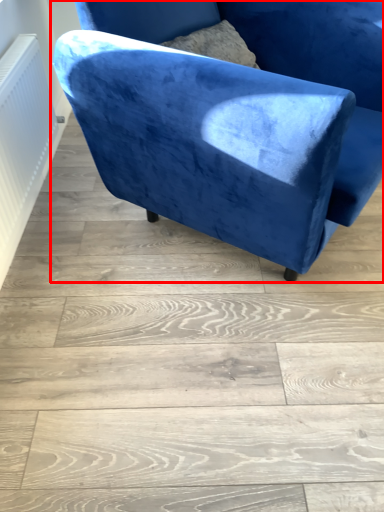
Question: Considering the relative positions of chair (annotated by the red box) and radiator in the image provided, where is chair (annotated by the red box) located with respect to the staircase?

Choices:
 (A) right
 (B) left

Answer: (A)